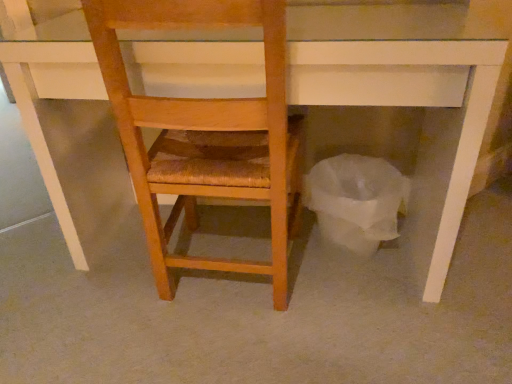
Question: Considering the positions of white paper bag at lower right and wooden chair at center in the image, is white paper bag at lower right taller or shorter than wooden chair at center?

Choices:
 (A) short
 (B) tall

Answer: (A)

Question: Based on their positions, is white paper bag at lower right located to the left or right of wooden chair at center?

Choices:
 (A) right
 (B) left

Answer: (A)

Question: Looking at their shapes, would you say white paper bag at lower right is wider or thinner than wooden chair at center?

Choices:
 (A) wide
 (B) thin

Answer: (B)

Question: Would you say wooden chair at center is inside or outside white paper bag at lower right?

Choices:
 (A) inside
 (B) outside

Answer: (B)

Question: From the image's perspective, is wooden chair at center located above or below white paper bag at lower right?

Choices:
 (A) above
 (B) below

Answer: (A)

Question: In the image, is wooden chair at center on the left side or the right side of white paper bag at lower right?

Choices:
 (A) right
 (B) left

Answer: (B)

Question: From their relative heights in the image, would you say wooden chair at center is taller or shorter than white paper bag at lower right?

Choices:
 (A) short
 (B) tall

Answer: (B)